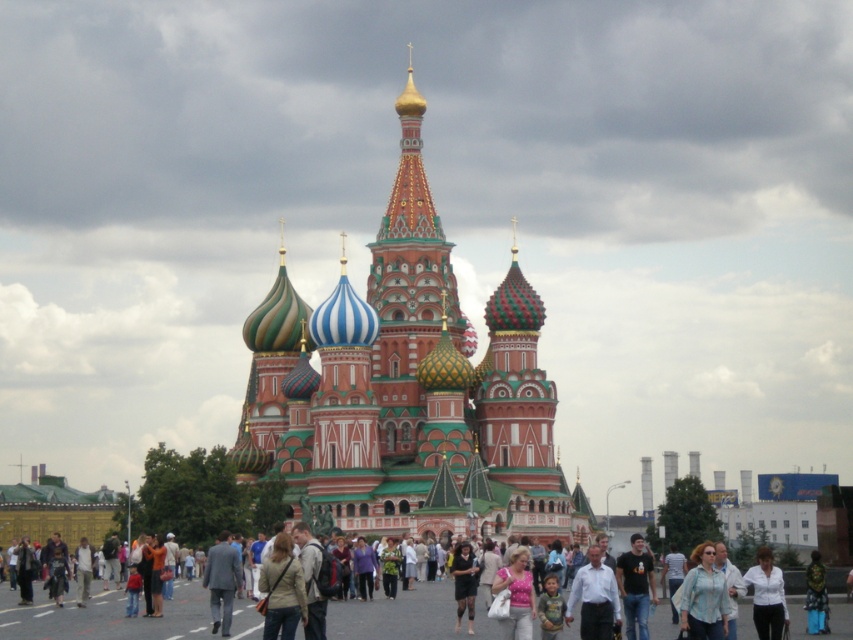
Question: Which point appears closest to the camera in this image?

Choices:
 (A) (762, 608)
 (B) (463, 595)
 (C) (706, 600)
 (D) (376, 300)

Answer: (C)

Question: Can you confirm if multicolored mosaic dome at center is thinner than black fabric shirt at center?

Choices:
 (A) no
 (B) yes

Answer: (A)

Question: Among these objects, which one is nearest to the camera?

Choices:
 (A) light beige jacket at center
 (B) pink fabric dress at center

Answer: (A)

Question: Is blue plaid shirt at lower right to the right of white matte shirt at center from the viewer's perspective?

Choices:
 (A) no
 (B) yes

Answer: (A)

Question: Does multicolored mosaic dome at center have a smaller size compared to light beige jacket at center?

Choices:
 (A) yes
 (B) no

Answer: (B)

Question: Which object is positioned closest to the light beige jacket at center?

Choices:
 (A) pink fabric dress at center
 (B) blue plaid shirt at lower right
 (C) multicolored mosaic dome at center

Answer: (A)